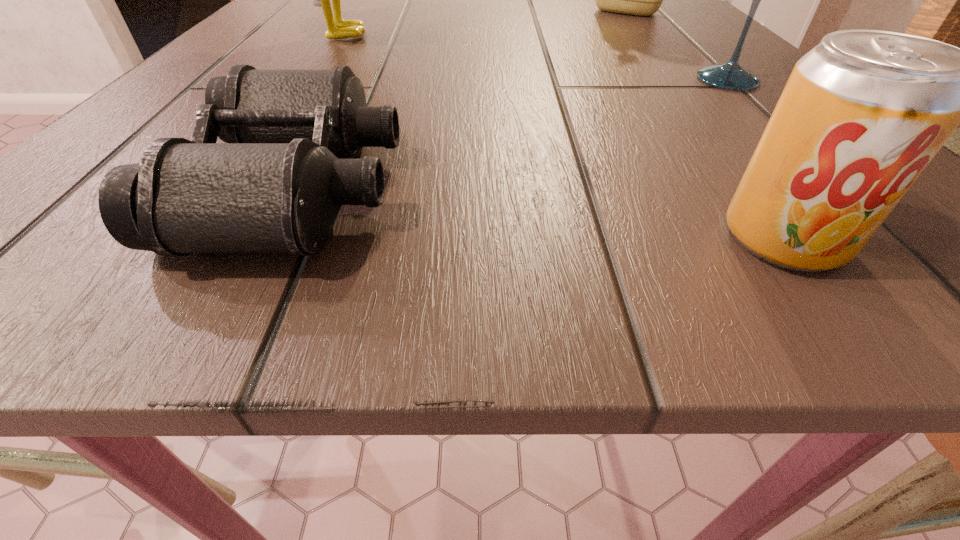
Locate which object is the fourth closest to the gull. Please provide its 2D coordinates. Your answer should be formatted as a tuple, i.e. [(x, y)], where the tuple contains the x and y coordinates of a point satisfying the conditions above.

[(863, 113)]

The width and height of the screenshot is (960, 540). What are the coordinates of `free space that satisfies the following two spatial constraints: 1. through the eyepieces of the shortest object; 2. on the left side of the fourth tallest object` in the screenshot? It's located at (272, 239).

The width and height of the screenshot is (960, 540). In order to click on vacant area that satisfies the following two spatial constraints: 1. on the back side of the third shortest object; 2. on the beak of the tallest object in this screenshot , I will do 681,34.

Locate an element on the screen. The height and width of the screenshot is (540, 960). vacant space that satisfies the following two spatial constraints: 1. through the eyepieces of the shortest object; 2. on the left side of the pop (soda) is located at coordinates (272, 239).

This screenshot has height=540, width=960. Find the location of `free space that satisfies the following two spatial constraints: 1. on the front side of the detergent; 2. on the beak of the gull`. free space that satisfies the following two spatial constraints: 1. on the front side of the detergent; 2. on the beak of the gull is located at coordinates (644, 34).

Locate an element on the screen. This screenshot has width=960, height=540. vacant space that satisfies the following two spatial constraints: 1. on the beak of the gull; 2. on the right side of the fourth tallest object is located at coordinates (193, 239).

I want to click on vacant space that satisfies the following two spatial constraints: 1. on the back side of the third tallest object; 2. on the right side of the pop (soda), so click(664, 80).